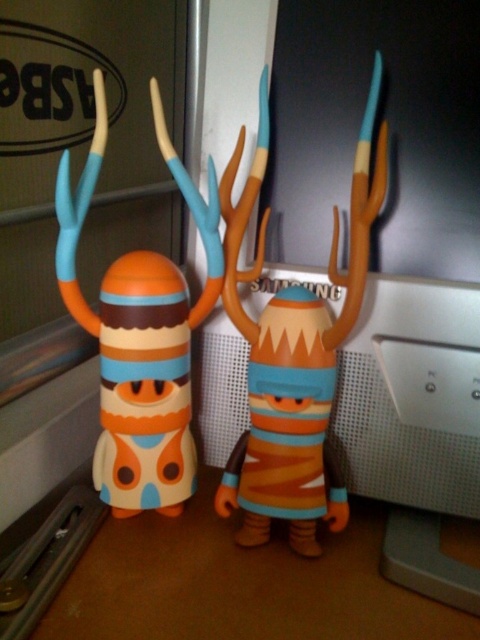
Question: Can you confirm if matte plastic toy at center is wider than matte plastic toy at left?

Choices:
 (A) no
 (B) yes

Answer: (A)

Question: From the image, what is the correct spatial relationship of matte plastic toy at center in relation to matte plastic toy at left?

Choices:
 (A) left
 (B) right

Answer: (B)

Question: Which point is farther to the camera?

Choices:
 (A) pyautogui.click(x=95, y=163)
 (B) pyautogui.click(x=312, y=497)

Answer: (B)

Question: Which object appears farthest from the camera in this image?

Choices:
 (A) matte plastic toy at left
 (B) matte plastic toy at center

Answer: (B)

Question: From the image, what is the correct spatial relationship of matte plastic toy at center in relation to matte plastic toy at left?

Choices:
 (A) below
 (B) above

Answer: (A)